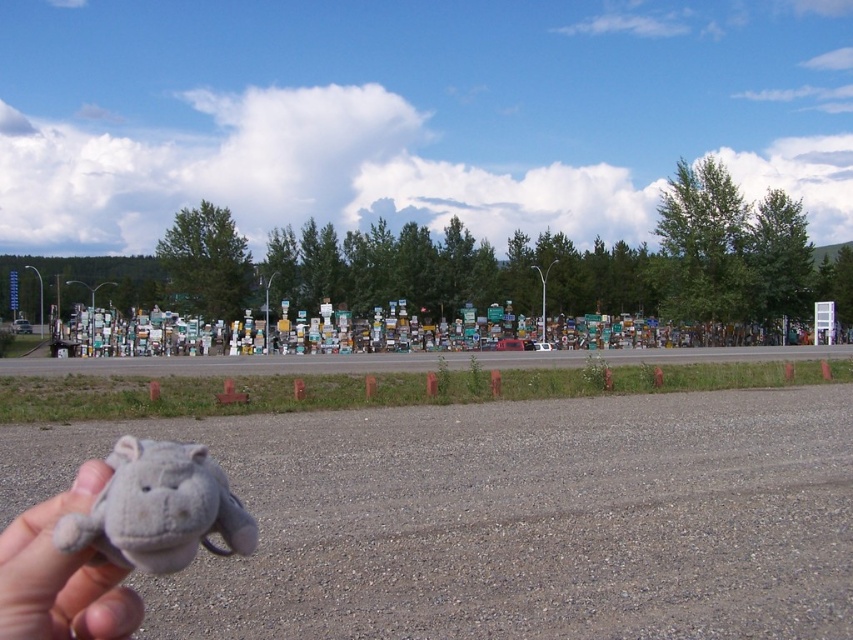
Question: Observing the image, what is the correct spatial positioning of gray plush hippo at lower left in reference to fuzzy gray stuffed animal at lower left?

Choices:
 (A) left
 (B) right

Answer: (B)

Question: Is the position of gray plush hippo at lower left less distant than that of fuzzy gray stuffed animal at lower left?

Choices:
 (A) no
 (B) yes

Answer: (B)

Question: Which of the following is the farthest from the observer?

Choices:
 (A) (155, 440)
 (B) (44, 540)

Answer: (A)

Question: Is gray plush hippo at lower left closer to camera compared to fuzzy gray stuffed animal at lower left?

Choices:
 (A) yes
 (B) no

Answer: (A)

Question: Which of the following is the farthest from the observer?

Choices:
 (A) (28, 616)
 (B) (138, 554)

Answer: (A)